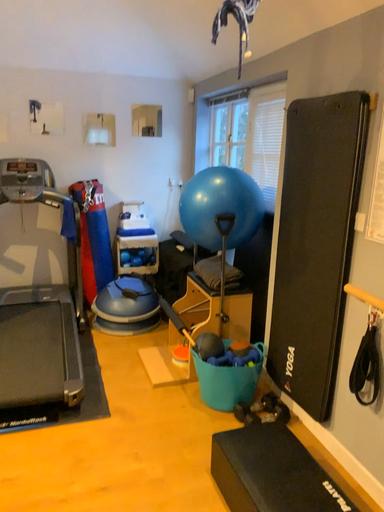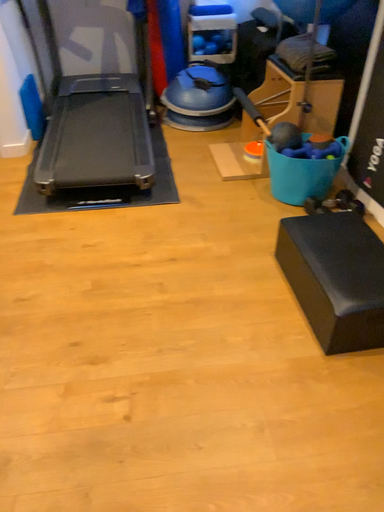
Question: Which way did the camera rotate in the video?

Choices:
 (A) rotated upward
 (B) rotated downward

Answer: (B)